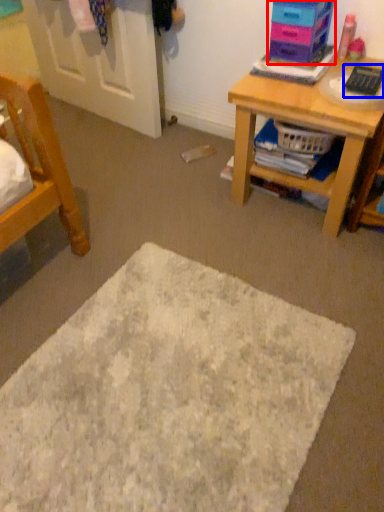
Question: Which object is closer to the camera taking this photo, shelf (highlighted by a red box) or remote control (highlighted by a blue box)?

Choices:
 (A) shelf
 (B) remote control

Answer: (B)